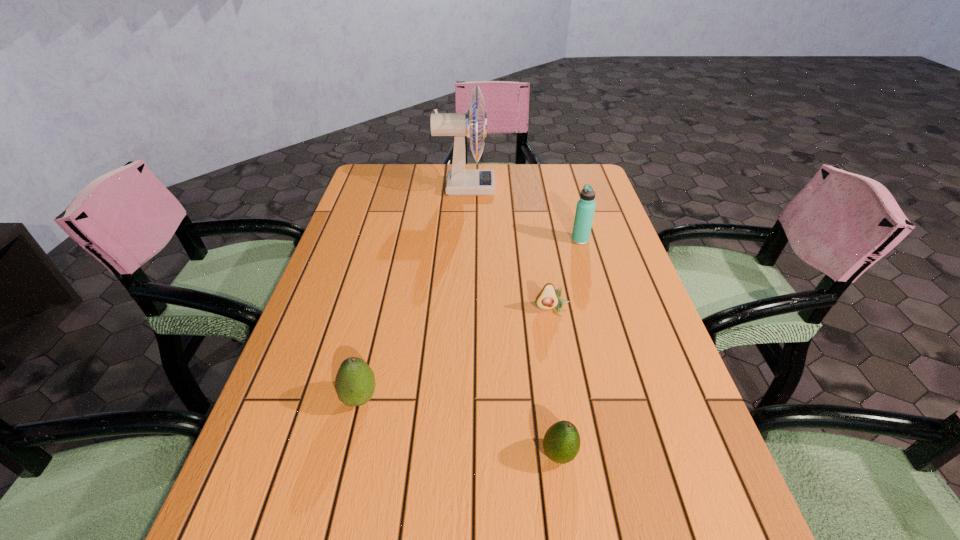
This screenshot has width=960, height=540. Identify the location of vacant position located on the back of the third shortest object. (381, 308).

The image size is (960, 540). Find the location of `free space located 0.180m on the back of the nearest object`. free space located 0.180m on the back of the nearest object is located at coordinates (545, 359).

The height and width of the screenshot is (540, 960). In order to click on free point located 0.340m on the seed side of the farthest avocado in this screenshot , I will do `click(578, 456)`.

This screenshot has width=960, height=540. I want to click on object located in the far edge section of the desktop, so click(x=460, y=181).

Locate an element on the screen. object located in the left edge section of the desktop is located at coordinates coord(355,384).

Where is `object that is at the right edge`? object that is at the right edge is located at coordinates (585, 209).

Image resolution: width=960 pixels, height=540 pixels. I want to click on vacant region at the far edge of the desktop, so click(x=545, y=166).

In the image, there is a desktop. Where is `vacant space at the left edge`? vacant space at the left edge is located at coordinates (340, 435).

What are the coordinates of `free space at the right edge of the desktop` in the screenshot? It's located at (651, 312).

Where is `vacant area at the far left corner of the desktop`? vacant area at the far left corner of the desktop is located at coordinates (377, 176).